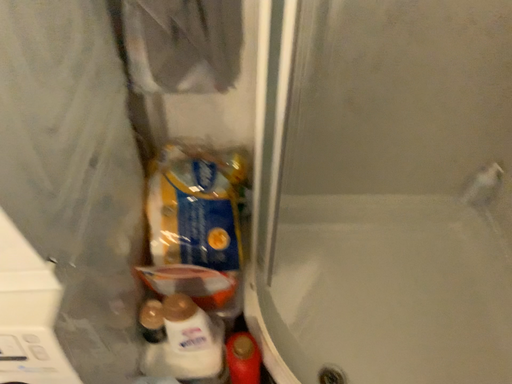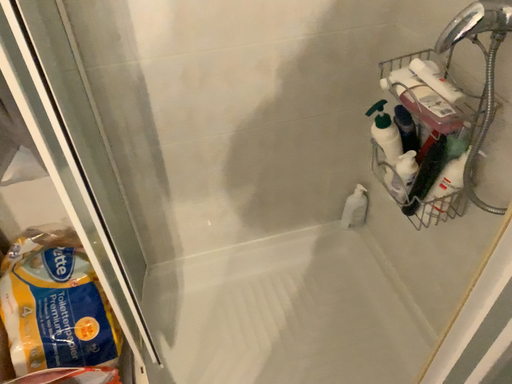
Question: Which way did the camera rotate in the video?

Choices:
 (A) rotated left
 (B) rotated right

Answer: (B)